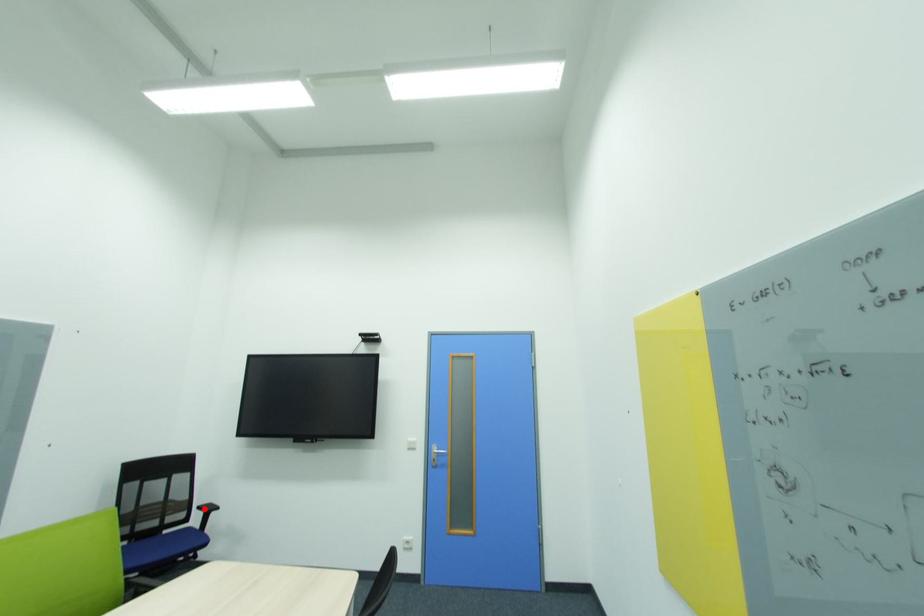
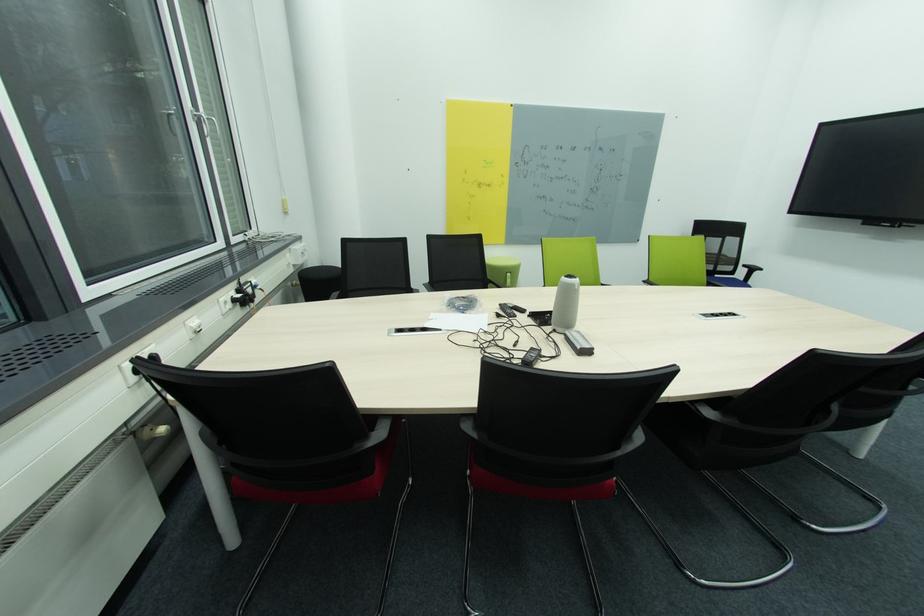
Question: I am providing you with two images of the same scene from different viewpoints. A red point is marked on the first image. At the location where the point appears in image 1, is it still visible in image 2?

Choices:
 (A) Yes
 (B) No

Answer: (A)